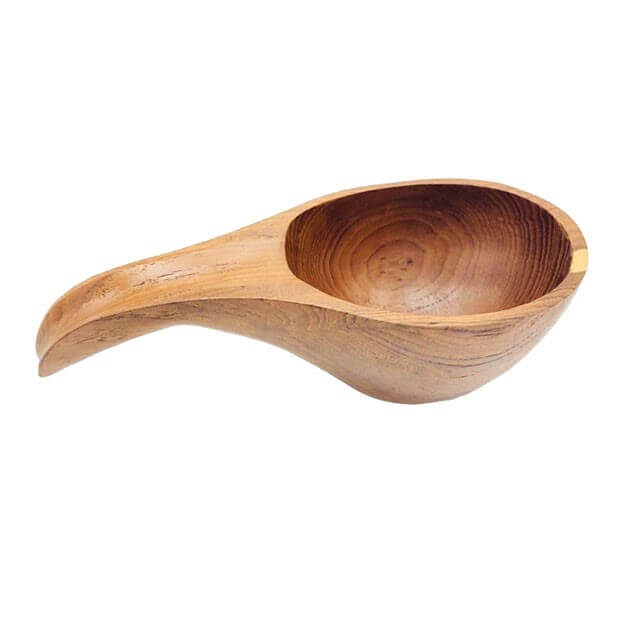
Find the location of `handle`. handle is located at coordinates (81, 304).